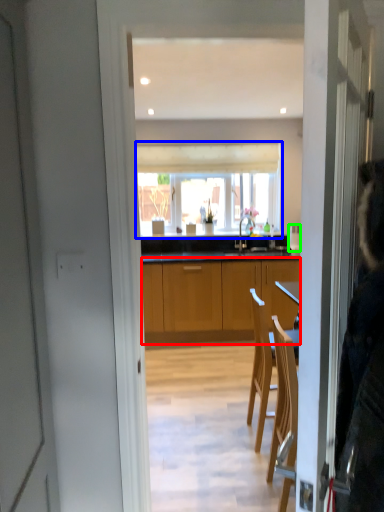
Question: Considering the real-world distances, which object is farthest from cabinetry (highlighted by a red box)? window (highlighted by a blue box) or kitchen appliance (highlighted by a green box)?

Choices:
 (A) window
 (B) kitchen appliance

Answer: (B)